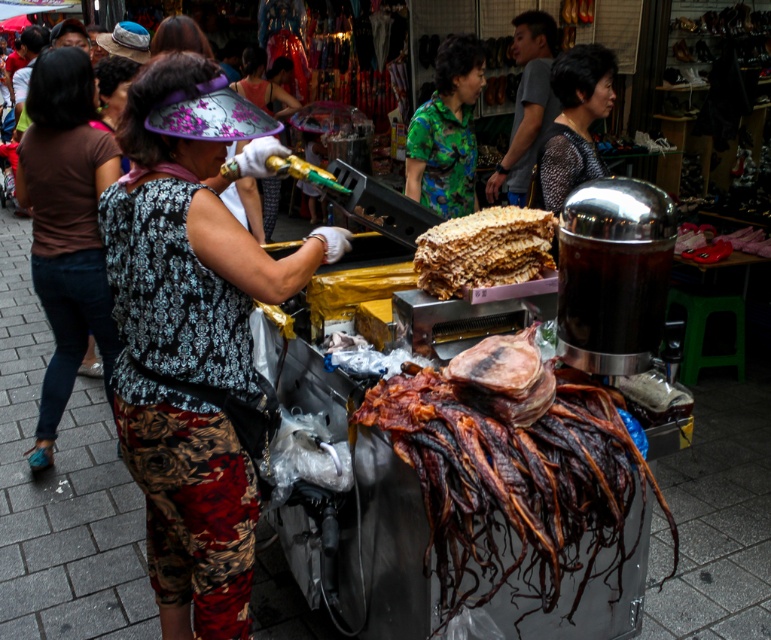
You are a food vendor at the market and want to place a new sign above both the green printed shirt at center and the crumbly golden cake at center. Which object should the sign be placed above to ensure it is visible over both?

The sign should be placed above the green printed shirt at center because it is taller than the crumbly golden cake at center, ensuring visibility over both.

Consider the image. You are a food vendor at the market and need to pack items for delivery. You have a green printed shirt at center and a crumbly golden cake at center. Which item is thinner and easier to fit into a narrow box?

The green printed shirt at center is thinner than the crumbly golden cake at center, so it is easier to fit into a narrow box.

You are a customer looking at the vendor and want to point out the patterned fabric headwear at center and the black dotted blouse at upper center. Which one is located to the left?

The patterned fabric headwear at center is to the left of the black dotted blouse at upper center.